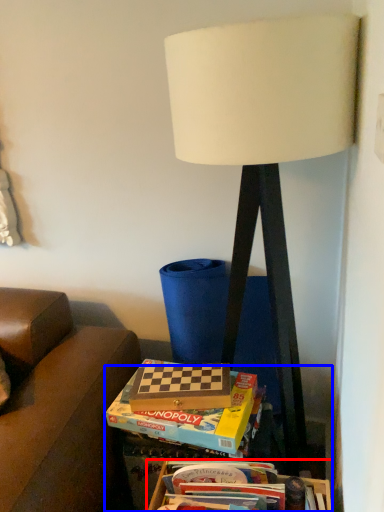
Question: Which object is further to the camera taking this photo, box (highlighted by a red box) or table (highlighted by a blue box)?

Choices:
 (A) box
 (B) table

Answer: (B)